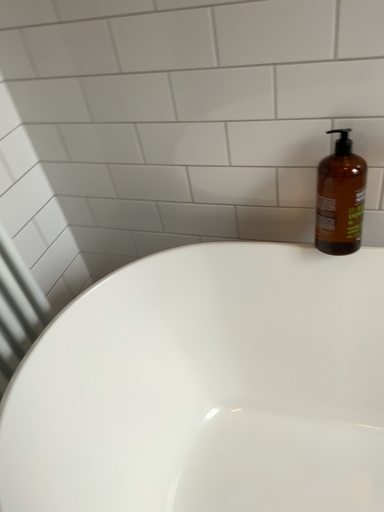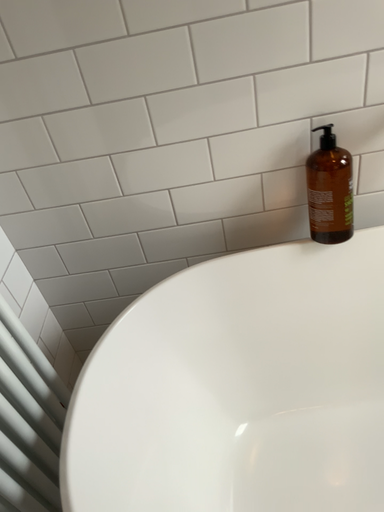
Question: How did the camera likely rotate when shooting the video?

Choices:
 (A) rotated right
 (B) rotated left

Answer: (A)